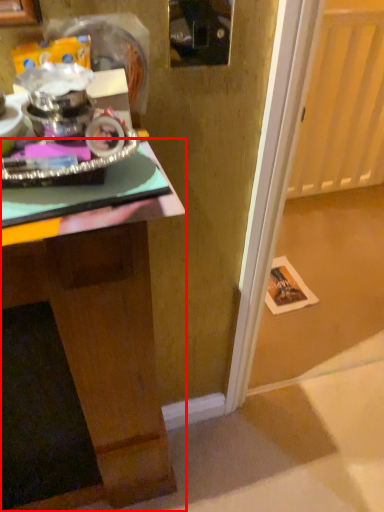
Question: From the image's perspective, what is the correct spatial positioning of desk (annotated by the red box) in reference to glass door?

Choices:
 (A) below
 (B) above

Answer: (A)